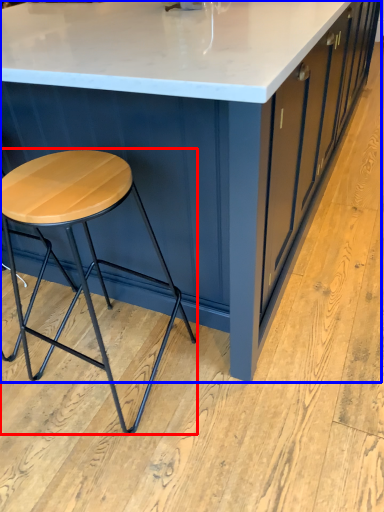
Question: Which point is further to the camera, stool (highlighted by a red box) or table (highlighted by a blue box)?

Choices:
 (A) stool
 (B) table

Answer: (A)